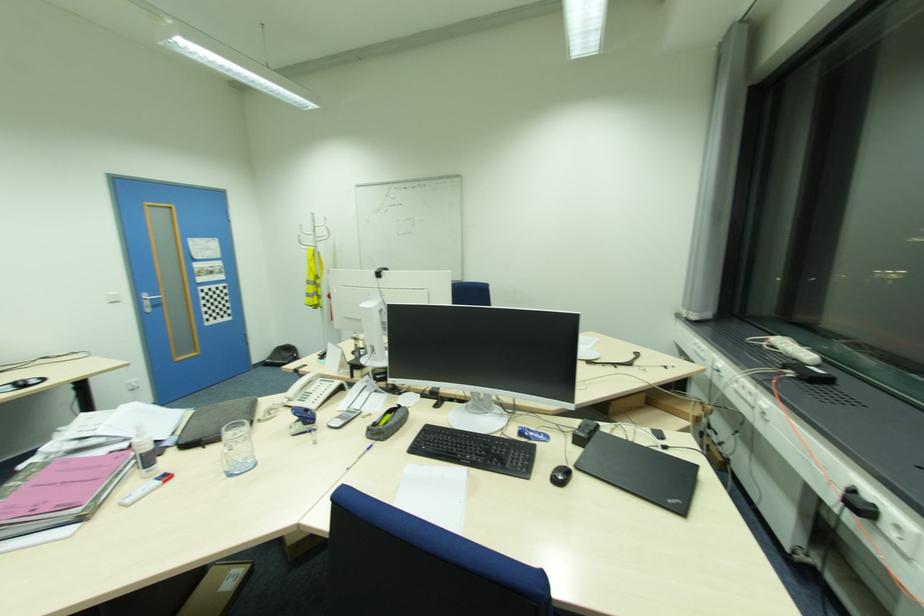
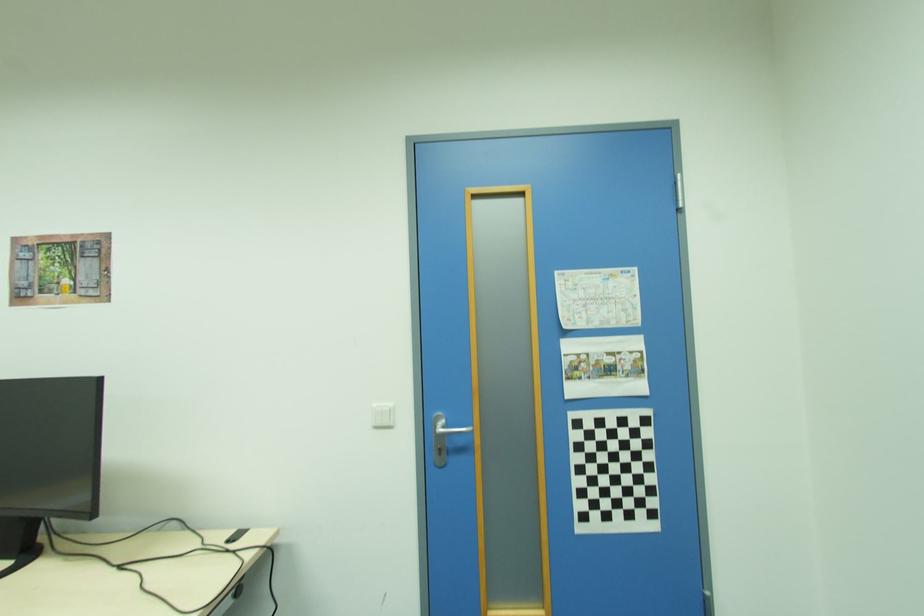
Find the pixel in the second image that matches point 122,302 in the first image.

(394, 427)